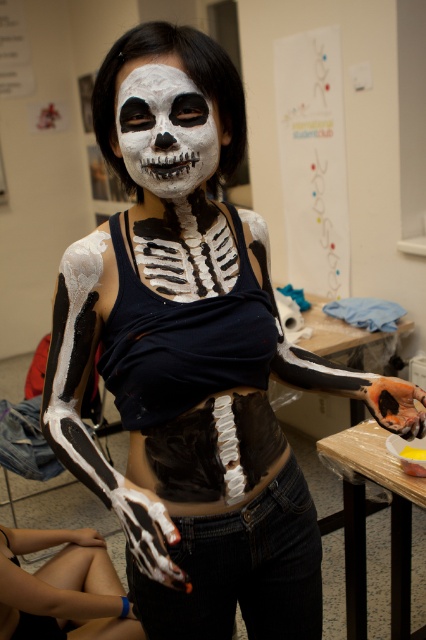
You are standing in the scene and want to reach both the point at coordinates point (80, 545) and the point at coordinates point (166, 83). Which point will you reach first if you move forward?

You will reach point (80, 545) first because it is closer to you than point (166, 83), which is further away.

You are an artist trying to create a proportional sculpture of the skeleton costume. You have the white matte skeleton hand at lower left and the white matte skull at center as references. Which object should you use as the scale reference if you want to ensure the skull in your sculpture is proportionally smaller than the hand?

The white matte skeleton hand at lower left is larger than the white matte skull at center. To ensure the skull in your sculpture is proportionally smaller than the hand, use the white matte skeleton hand at lower left as the scale reference.